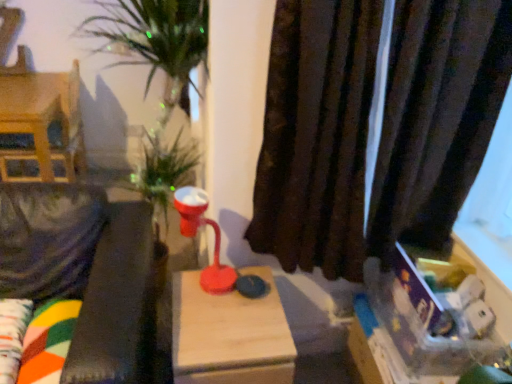
Question: Should I look upward or downward to see brown velvet curtain at right?

Choices:
 (A) down
 (B) up

Answer: (B)

Question: Is velvet green couch at left bigger than wooden table at center?

Choices:
 (A) yes
 (B) no

Answer: (A)

Question: Considering the relative sizes of velvet green couch at left and wooden table at center in the image provided, is velvet green couch at left taller than wooden table at center?

Choices:
 (A) yes
 (B) no

Answer: (A)

Question: Is velvet green couch at left outside wooden table at center?

Choices:
 (A) no
 (B) yes

Answer: (B)

Question: Is velvet green couch at left closer to camera compared to wooden table at center?

Choices:
 (A) no
 (B) yes

Answer: (B)

Question: Can you confirm if velvet green couch at left is shorter than wooden table at center?

Choices:
 (A) yes
 (B) no

Answer: (B)

Question: From a real-world perspective, is velvet green couch at left positioned under wooden table at center based on gravity?

Choices:
 (A) no
 (B) yes

Answer: (A)

Question: Does wooden dollhouse at left come behind matte plastic table lamp at center?

Choices:
 (A) no
 (B) yes

Answer: (B)

Question: Could you tell me if wooden dollhouse at left is facing matte plastic table lamp at center?

Choices:
 (A) no
 (B) yes

Answer: (A)

Question: Is wooden dollhouse at left not inside matte plastic table lamp at center?

Choices:
 (A) no
 (B) yes

Answer: (B)

Question: Can matte plastic table lamp at center be found inside wooden dollhouse at left?

Choices:
 (A) no
 (B) yes

Answer: (A)

Question: Is wooden dollhouse at left facing away from matte plastic table lamp at center?

Choices:
 (A) no
 (B) yes

Answer: (A)

Question: Is wooden dollhouse at left at the right side of matte plastic table lamp at center?

Choices:
 (A) no
 (B) yes

Answer: (A)

Question: Is wooden table at center turned away from matte plastic table lamp at center?

Choices:
 (A) no
 (B) yes

Answer: (A)